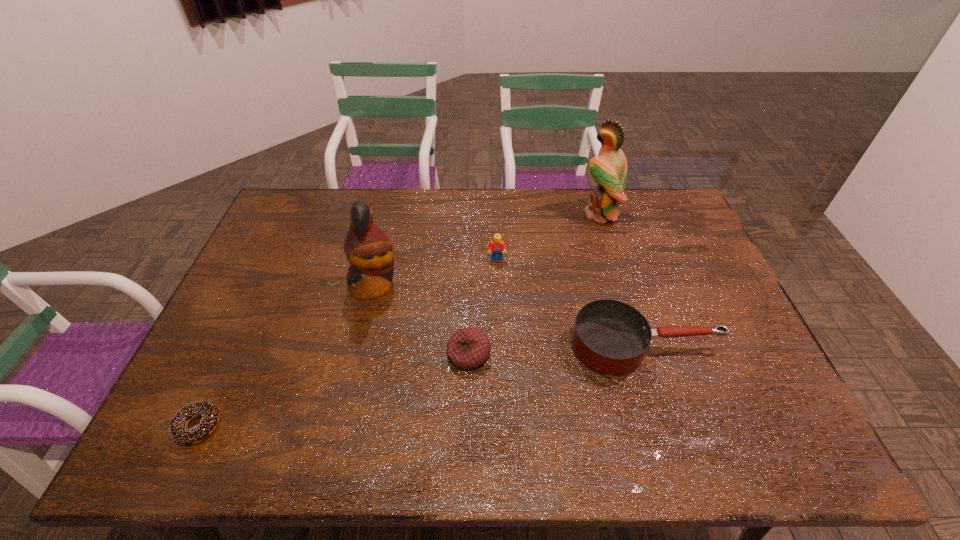
Locate an element on the screen. The height and width of the screenshot is (540, 960). the farthest object is located at coordinates (609, 169).

What are the coordinates of `the farther parrot` in the screenshot? It's located at (609, 169).

Identify the location of the nearer parrot. The image size is (960, 540). (368, 249).

I want to click on the third farthest object, so click(x=368, y=249).

This screenshot has width=960, height=540. Find the location of `the second farthest object`. the second farthest object is located at coordinates (496, 247).

At what (x,y) coordinates should I click in order to perform the action: click on Lego. Please return your answer as a coordinate pair (x, y). The image size is (960, 540). Looking at the image, I should click on (496, 247).

Where is `pan`? pan is located at coordinates (611, 337).

Image resolution: width=960 pixels, height=540 pixels. I want to click on the second shortest object, so click(x=468, y=348).

The image size is (960, 540). In order to click on doughnut in this screenshot , I will do `click(178, 430)`.

This screenshot has height=540, width=960. In order to click on the shortest object in this screenshot , I will do `click(178, 430)`.